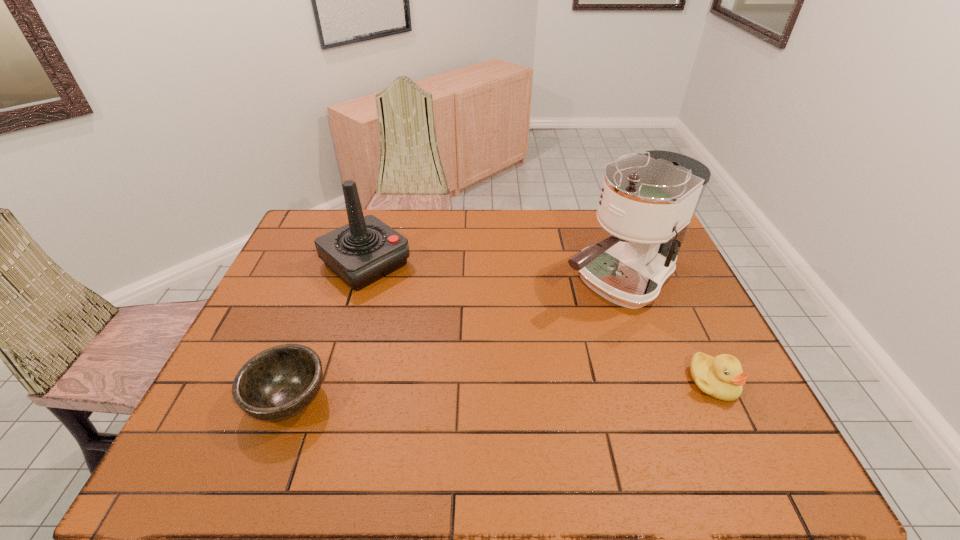
Locate an element on the screen. free space on the desktop that is between the bowl and the duckling and is positioned on the front-facing side of the joystick is located at coordinates (x=521, y=390).

Locate an element on the screen. Image resolution: width=960 pixels, height=540 pixels. free space on the desktop that is between the shortest object and the duckling and is positioned on the front-facing side of the coffee maker is located at coordinates (441, 393).